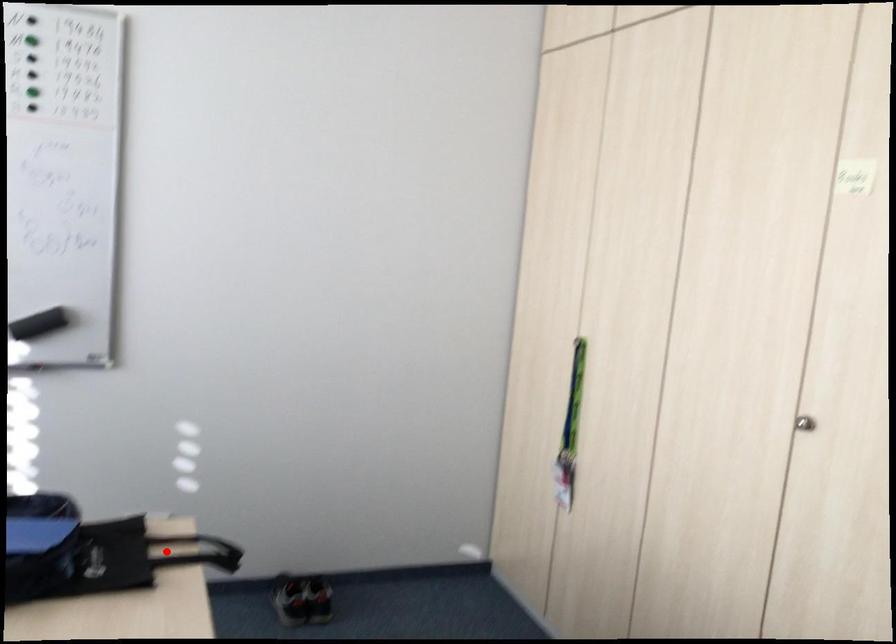
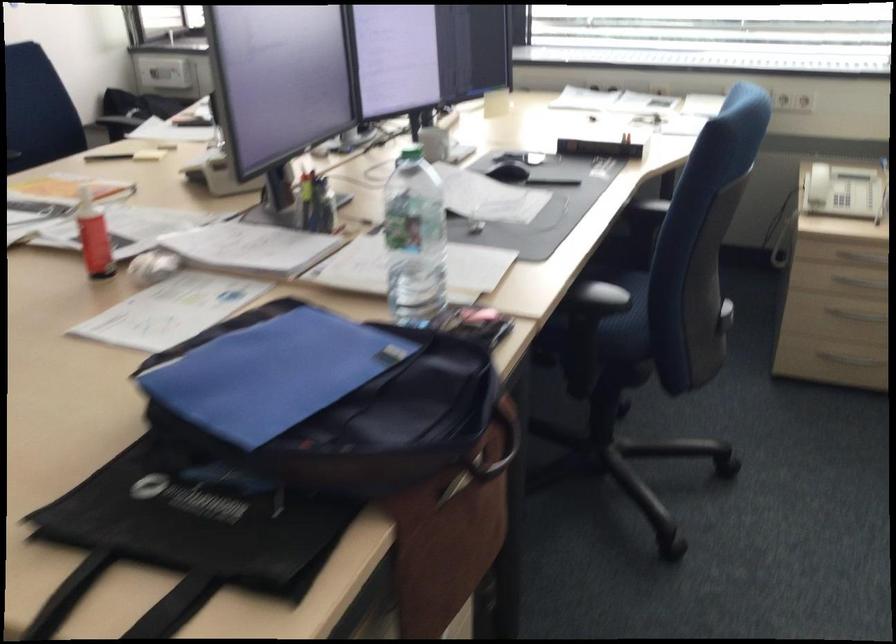
Question: I am providing you with two images of the same scene from different viewpoints. Given a red point in image1, look at the same physical point in image2. Is it:

Choices:
 (A) Closer to the viewpoint
 (B) Farther from the viewpoint

Answer: (A)